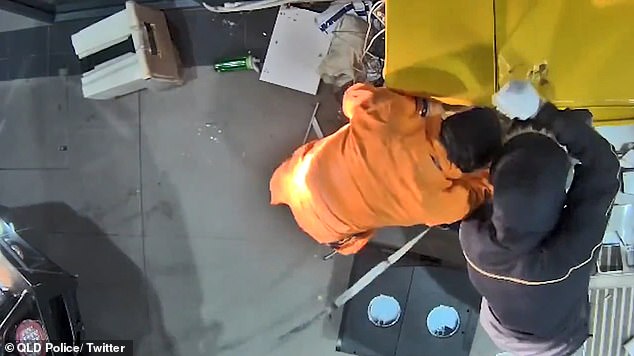
Identify the location of glass window. (382, 310), (437, 319).